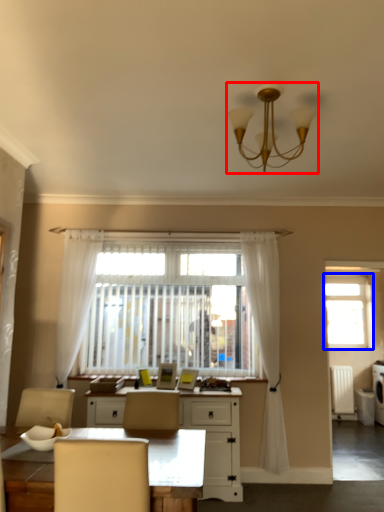
Question: Which object is further to the camera taking this photo, lamp (highlighted by a red box) or window (highlighted by a blue box)?

Choices:
 (A) lamp
 (B) window

Answer: (B)